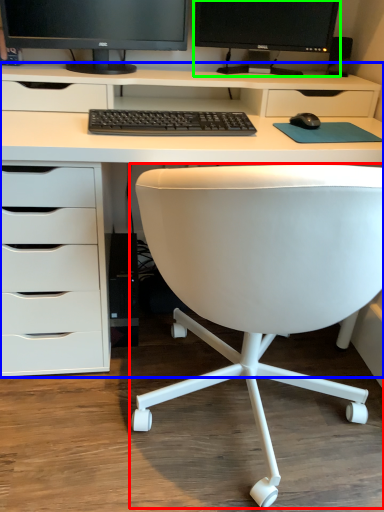
Question: Which object is the closest to the chair (highlighted by a red box)? Choose among these: desk (highlighted by a blue box) or computer monitor (highlighted by a green box).

Choices:
 (A) desk
 (B) computer monitor

Answer: (A)